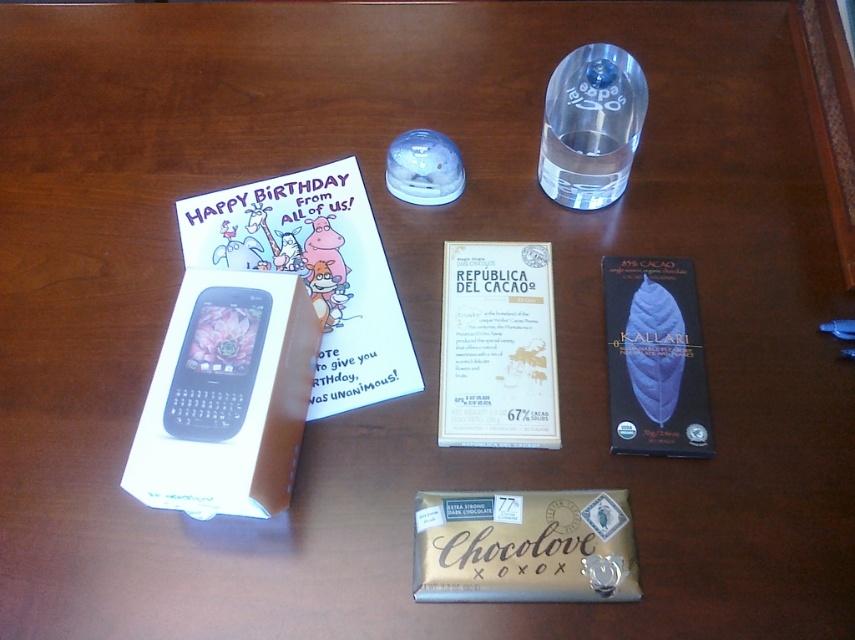
You are a delivery person who needs to place a small package between the gold foil chocolate bar at center and the transparent glass bottle at upper center. The package requires at least 12 inches of space. Can you fit it there?

The gold foil chocolate bar at center is 14.61 inches from the transparent glass bottle at upper center, which is more than the required 12 inches. Therefore, the package can be placed between them with sufficient space.

Based on the photo, you are a birthday guest who wants to grab the gold foil chocolate bar at center and dark chocolate bar at center right. Which one is closer to you?

The gold foil chocolate bar at center is closer to you because it is in front of the dark chocolate bar at center right.